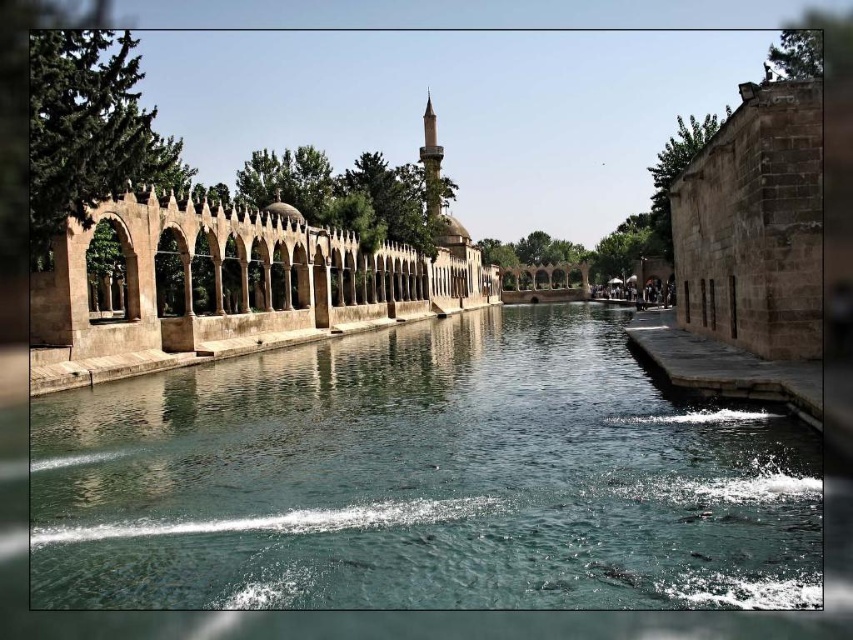
I want to click on clear stone water at center, so click(422, 480).

Can you confirm if clear stone water at center is smaller than brown stone palace at center?

Yes.

At what (x,y) coordinates should I click in order to perform the action: click on clear stone water at center. Please return your answer as a coordinate pair (x, y). This screenshot has width=853, height=640. Looking at the image, I should click on (422, 480).

Locate an element on the screen. The image size is (853, 640). clear stone water at center is located at coordinates (422, 480).